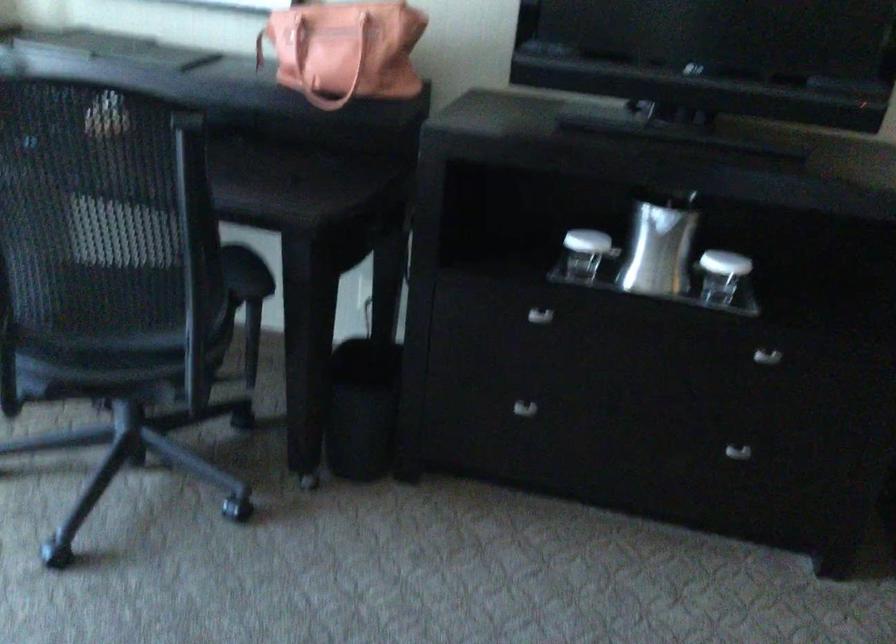
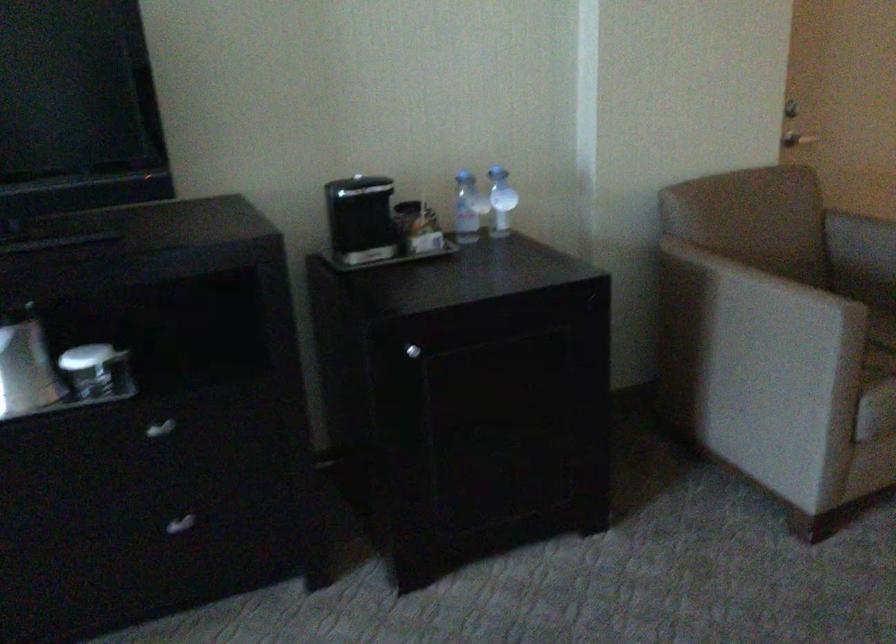
Question: How did the camera likely rotate?

Choices:
 (A) Left
 (B) Right
 (C) Up
 (D) Down

Answer: (B)